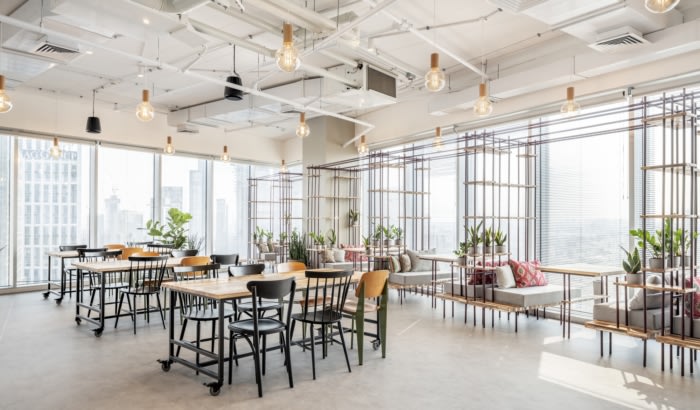
Identify the location of table. The image size is (700, 410). (580, 270), (446, 253), (210, 286), (102, 265), (57, 253).